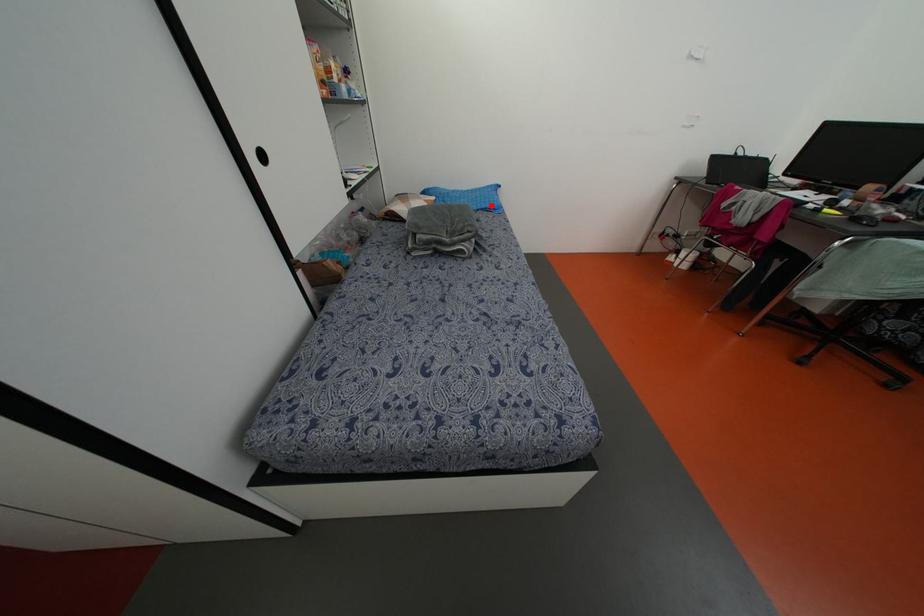
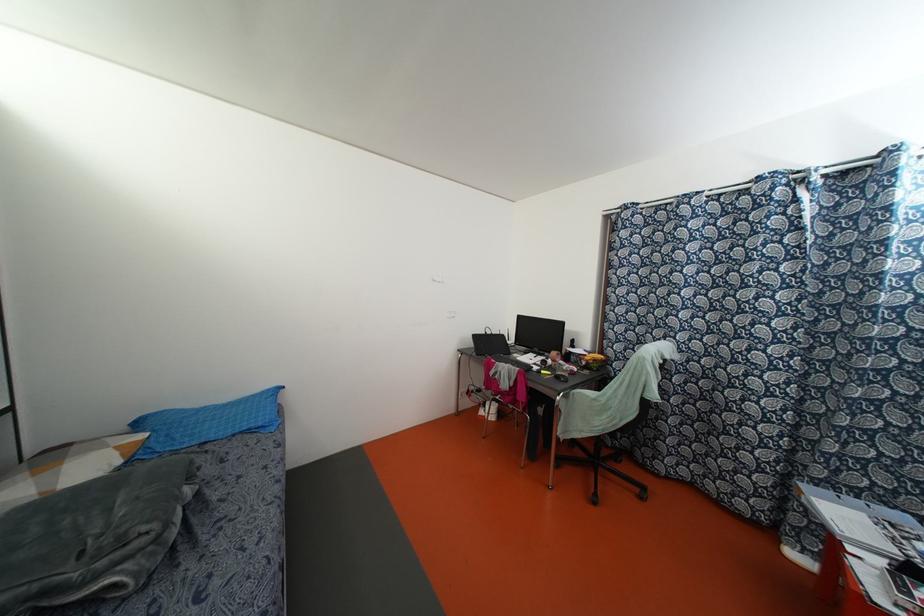
Locate, in the second image, the point that corresponds to the highlighted location in the first image.

(259, 424)